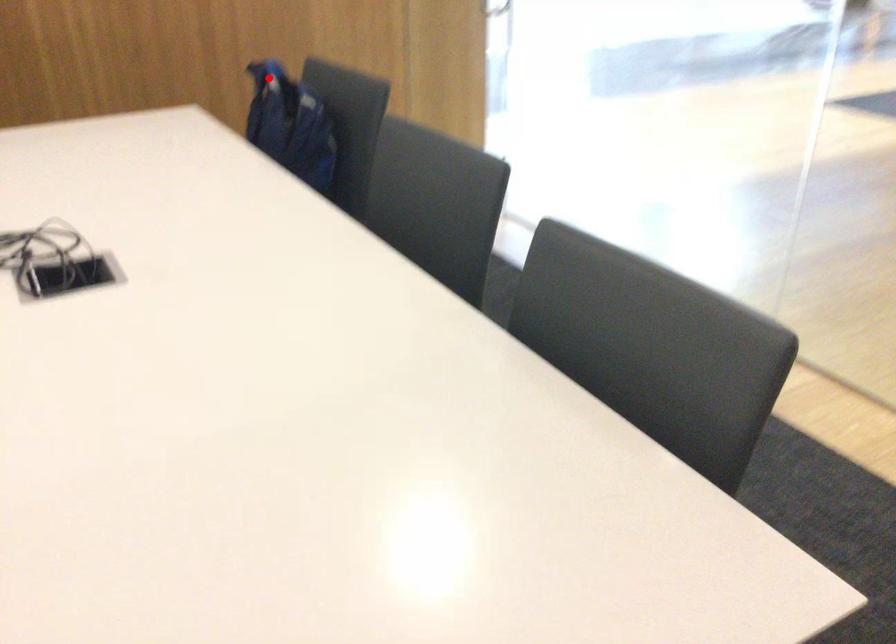
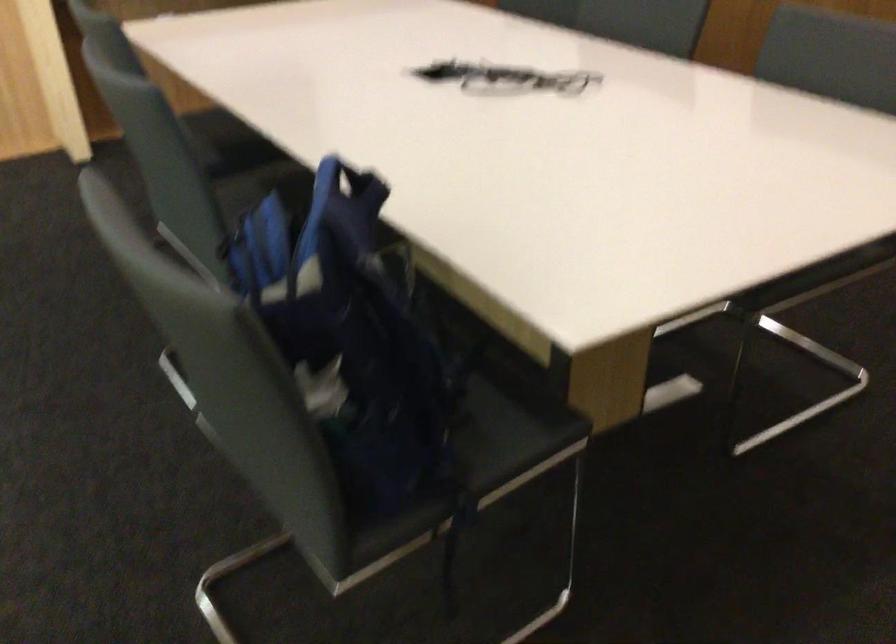
Locate, in the second image, the point that corresponds to the highlighted location in the first image.

(349, 184)